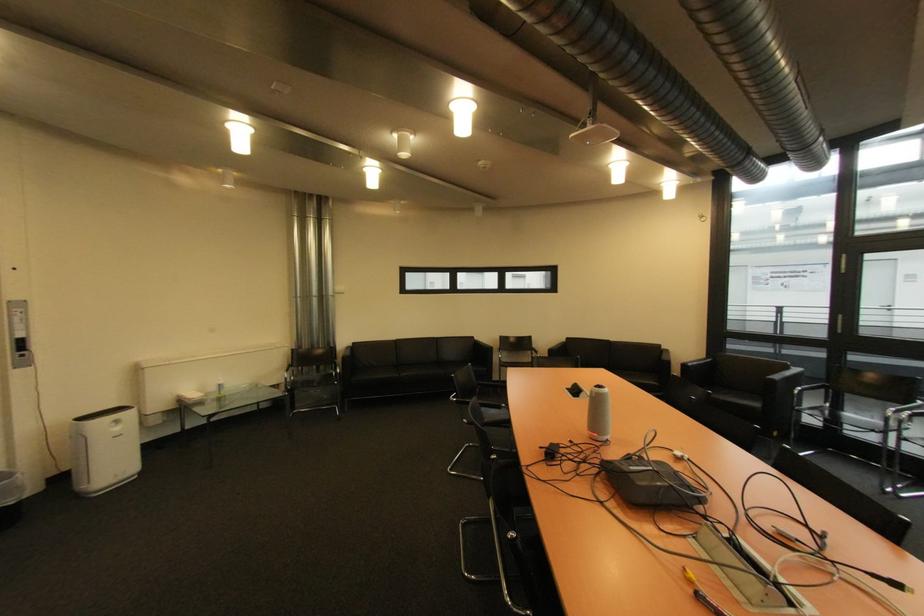
Where is `white air purifier`? white air purifier is located at coordinates (104, 450).